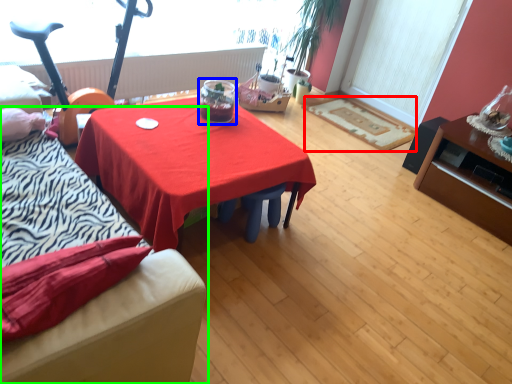
Question: Considering the real-world distances, which object is farthest from mat (highlighted by a red box)? glass jar (highlighted by a blue box) or studio couch (highlighted by a green box)?

Choices:
 (A) glass jar
 (B) studio couch

Answer: (B)